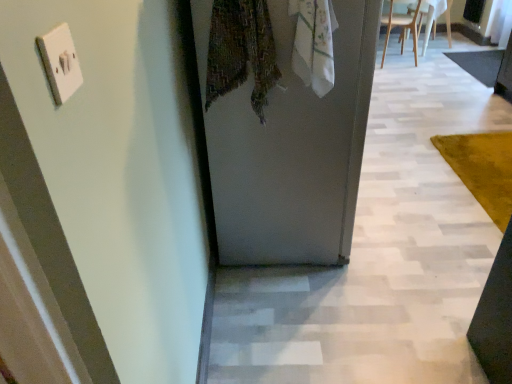
Question: Is there a large distance between white matte door at center and white plastic chair at upper right, the 2th chair positioned from the left?

Choices:
 (A) no
 (B) yes

Answer: (B)

Question: Is white matte door at center completely or partially outside of white plastic chair at upper right, the 2th chair positioned from the left?

Choices:
 (A) yes
 (B) no

Answer: (A)

Question: Considering the relative sizes of white matte door at center and white plastic chair at upper right, the 2th chair positioned from the left, in the image provided, is white matte door at center thinner than white plastic chair at upper right, the 2th chair positioned from the left,?

Choices:
 (A) no
 (B) yes

Answer: (A)

Question: From the image's perspective, would you say white matte door at center is positioned over white plastic chair at upper right, the first chair positioned from the right?

Choices:
 (A) yes
 (B) no

Answer: (B)

Question: Is white matte door at center turned away from white plastic chair at upper right, the 2th chair positioned from the left?

Choices:
 (A) yes
 (B) no

Answer: (B)

Question: Is the depth of white matte door at center greater than that of white plastic chair at upper right, the first chair positioned from the right?

Choices:
 (A) no
 (B) yes

Answer: (A)

Question: Is white plastic switch at upper left smaller than white matte door at center?

Choices:
 (A) no
 (B) yes

Answer: (B)

Question: Does white plastic switch at upper left have a lesser height compared to white matte door at center?

Choices:
 (A) no
 (B) yes

Answer: (B)

Question: Is white plastic switch at upper left thinner than white matte door at center?

Choices:
 (A) no
 (B) yes

Answer: (B)

Question: Is white plastic switch at upper left further to camera compared to white matte door at center?

Choices:
 (A) yes
 (B) no

Answer: (B)

Question: From a real-world perspective, is white plastic switch at upper left on top of white matte door at center?

Choices:
 (A) no
 (B) yes

Answer: (B)

Question: Is white plastic switch at upper left turned away from white matte door at center?

Choices:
 (A) no
 (B) yes

Answer: (A)

Question: Considering the relative sizes of white plastic chair at upper right, the first chair positioned from the right, and white matte door at center in the image provided, is white plastic chair at upper right, the first chair positioned from the right, taller than white matte door at center?

Choices:
 (A) no
 (B) yes

Answer: (A)